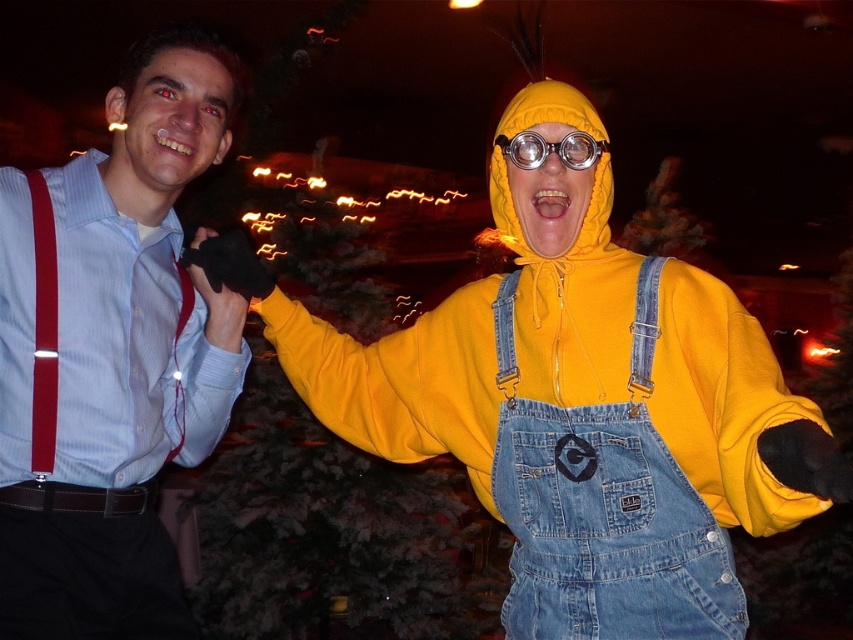
You are standing at the center of the image and want to take a photo of both the person on the left and the person on the right. Which person is closer to you, the one at point [225,305] or the one at point [605,332]?

Point [225,305] is behind point [605,332], so the person at point [605,332] is closer to you.

You are a photographer trying to capture the festive scene. You notice two items in the frame that are important for the shot. The yellow fleece jacket at right and the clear plastic goggles at center. Which one is positioned more to the right side of the image?

The yellow fleece jacket at right is positioned more to the right side of the image compared to the clear plastic goggles at center.

You are a photographer at the event and need to capture a photo of both the yellow fleece jacket at right and the clear plastic goggles at center. The camera has a 10 inch minimum focus distance. Can you include both objects in the same frame without moving the camera?

The distance between the yellow fleece jacket at right and the clear plastic goggles at center is 12.02 inches. Since the minimum focus distance is 10 inches, you can include both objects in the same frame without moving the camera because the distance is within the camera range.